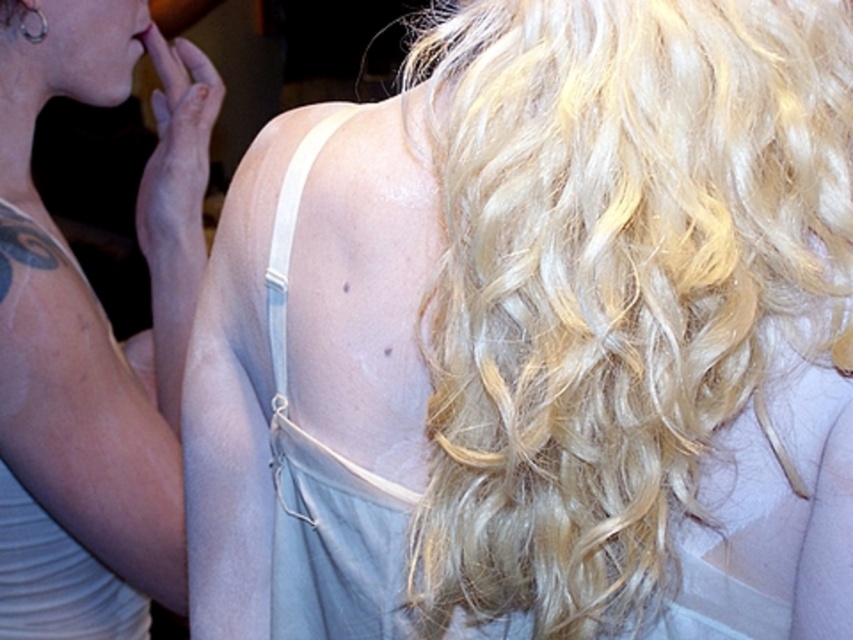
You are an artist sketching the scene and need to place the blonde hair at upper right accurately. According to the coordinates provided, where should you position it on your drawing canvas?

The blonde hair at upper right should be positioned at coordinates point (97,300).

You are a makeup artist observing the scene. You notice the matte pink lipstick at upper left and the blonde hair at upper right. Which object is located to the left of the other?

The blonde hair at upper right is positioned on the left side of matte pink lipstick at upper left.

You are a photographer setting up for a portrait. You need to position a light source to the left of the white matte dress at left and to the right of the blonde hair at upper right. Is this possible given their positions?

The blonde hair at upper right is to the right of the white matte dress at left, so placing a light source to the left of the white matte dress at left and to the right of the blonde hair at upper right is not possible because the white matte dress at left is already positioned to the left of the blonde hair at upper right.